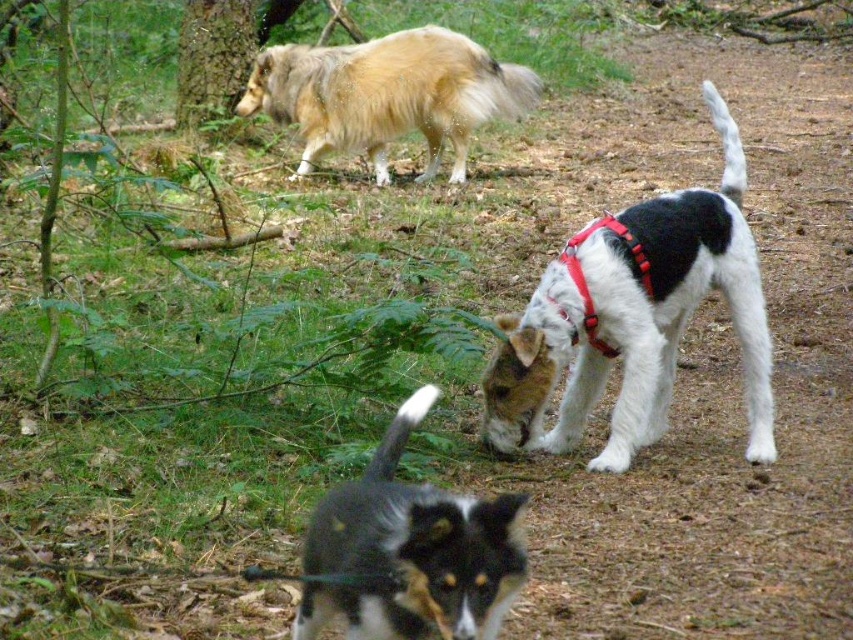
How far apart are white fur with black spots at center and golden fur dog at upper left?

white fur with black spots at center and golden fur dog at upper left are 12.56 feet apart.

Does point (585, 340) come behind point (340, 77)?

No, (585, 340) is in front of (340, 77).

Locate an element on the screen. white fur with black spots at center is located at coordinates (679, 300).

Does white fur with black spots at center appear on the left side of black and white fur at lower center?

No, white fur with black spots at center is not to the left of black and white fur at lower center.

Which is behind, point (502, 348) or point (479, 522)?

The point (502, 348) is behind.

Is point (660, 230) positioned in front of point (485, 604)?

No, it is behind (485, 604).

Identify the location of white fur with black spots at center. The width and height of the screenshot is (853, 640). (679, 300).

Consider the image. Which of these two, black and white fur at lower center or golden fur dog at upper left, stands taller?

golden fur dog at upper left

Between point (364, 560) and point (430, 65), which one is positioned behind?

The point (430, 65) is behind.

At what (x,y) coordinates should I click in order to perform the action: click on black and white fur at lower center. Please return your answer as a coordinate pair (x, y). The height and width of the screenshot is (640, 853). Looking at the image, I should click on (410, 552).

At what (x,y) coordinates should I click in order to perform the action: click on black and white fur at lower center. Please return your answer as a coordinate pair (x, y). Looking at the image, I should click on (410, 552).